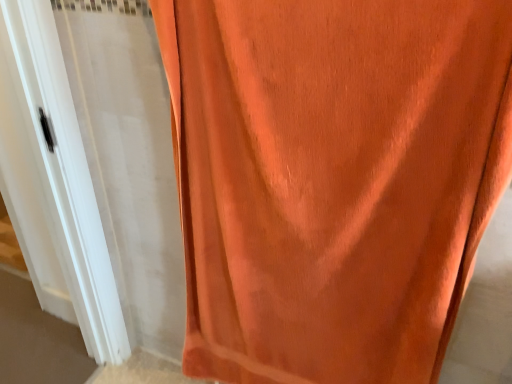
Describe the element at coordinates (333, 179) in the screenshot. This screenshot has width=512, height=384. I see `orange velvet curtain at center` at that location.

Locate an element on the screen. This screenshot has width=512, height=384. orange velvet curtain at center is located at coordinates (333, 179).

The image size is (512, 384). I want to click on orange velvet curtain at center, so click(333, 179).